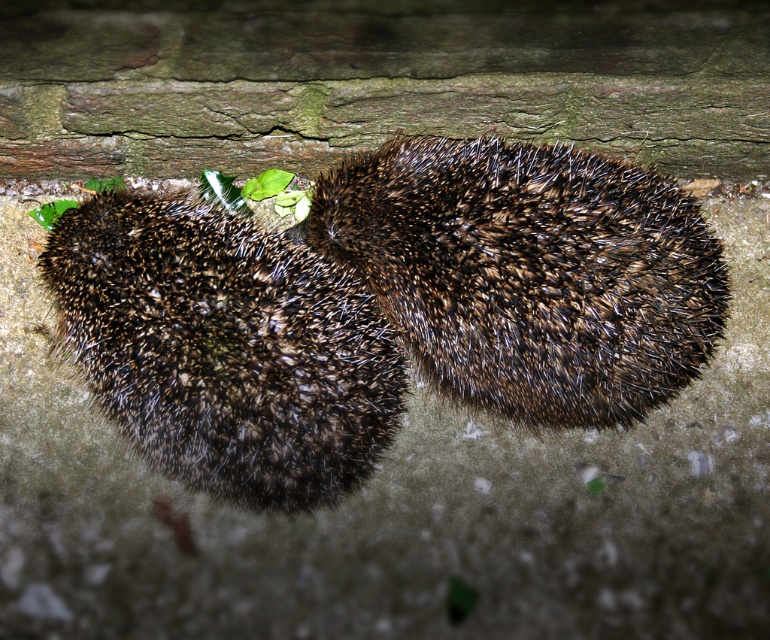
Question: Is brown spiny hedgehog at center above brown spiny hedgehog at left?

Choices:
 (A) yes
 (B) no

Answer: (A)

Question: Which object appears farthest from the camera in this image?

Choices:
 (A) brown spiny hedgehog at left
 (B) brown spiny hedgehog at center

Answer: (B)

Question: Which point is closer to the camera?

Choices:
 (A) brown spiny hedgehog at left
 (B) brown spiny hedgehog at center

Answer: (A)

Question: Does brown spiny hedgehog at center appear on the right side of brown spiny hedgehog at left?

Choices:
 (A) yes
 (B) no

Answer: (A)

Question: Is brown spiny hedgehog at center positioned behind brown spiny hedgehog at left?

Choices:
 (A) yes
 (B) no

Answer: (A)